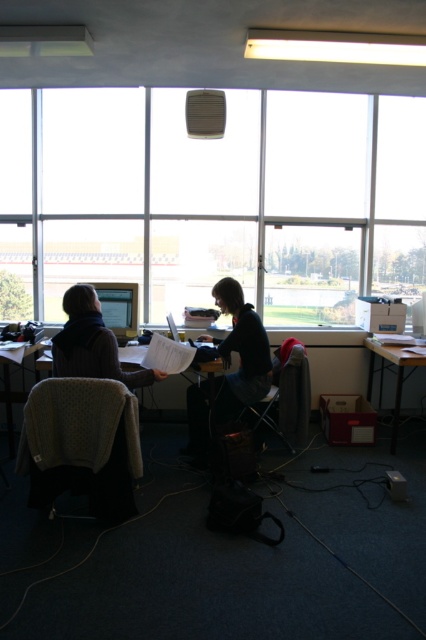
You are a person who needs to place a 3D printer that requires a flat surface at least 1 meter in height. Looking at the workspace, which object between the matte black computer desk at lower right and the white plastic table at center would be suitable for placing the 3D printer?

The matte black computer desk at lower right is much taller than the white plastic table at center, so the matte black computer desk at lower right would be suitable for placing the 3D printer as it meets the height requirement.

You are trying to place a new rectangular box that is 0.5 meters wide on the desk. The desk has a dark gray fabric jacket at center and a metallic gray chair at center. Can the box fit between them without overlapping either object?

The dark gray fabric jacket at center might be wider than metallic gray chair at center, so the box may not fit between them. Check the actual width of both objects before placing the box.